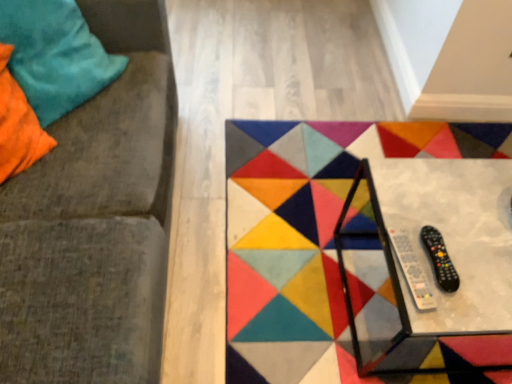
Question: Considering the relative sizes of velvety teal pillow at upper left and velvet cushion at left in the image provided, is velvety teal pillow at upper left shorter than velvet cushion at left?

Choices:
 (A) no
 (B) yes

Answer: (B)

Question: From the image's perspective, is velvety teal pillow at upper left located above velvet cushion at left?

Choices:
 (A) no
 (B) yes

Answer: (B)

Question: Considering the relative positions of velvety teal pillow at upper left and velvet cushion at left in the image provided, is velvety teal pillow at upper left in front of velvet cushion at left?

Choices:
 (A) yes
 (B) no

Answer: (B)

Question: Could you tell me if velvety teal pillow at upper left is turned towards velvet cushion at left?

Choices:
 (A) yes
 (B) no

Answer: (A)

Question: Could velvet cushion at left be considered to be inside velvety teal pillow at upper left?

Choices:
 (A) yes
 (B) no

Answer: (B)

Question: Does velvety teal pillow at upper left have a smaller size compared to velvet cushion at left?

Choices:
 (A) yes
 (B) no

Answer: (A)

Question: Is velvety teal pillow at upper left located within velvet cushion at left?

Choices:
 (A) no
 (B) yes

Answer: (B)

Question: Is velvet cushion at left at the right side of velvety teal pillow at upper left?

Choices:
 (A) yes
 (B) no

Answer: (B)

Question: Considering the relative positions of velvet cushion at left and velvety teal pillow at upper left in the image provided, is velvet cushion at left behind velvety teal pillow at upper left?

Choices:
 (A) yes
 (B) no

Answer: (B)

Question: Considering the relative positions of velvet cushion at left and velvety teal pillow at upper left in the image provided, is velvet cushion at left in front of velvety teal pillow at upper left?

Choices:
 (A) no
 (B) yes

Answer: (B)

Question: From a real-world perspective, is velvet cushion at left located higher than velvety teal pillow at upper left?

Choices:
 (A) no
 (B) yes

Answer: (A)

Question: Are velvet cushion at left and velvety teal pillow at upper left beside each other?

Choices:
 (A) yes
 (B) no

Answer: (B)

Question: Is metallic glass table at center completely or partially inside velvety teal pillow at upper left?

Choices:
 (A) no
 (B) yes

Answer: (A)